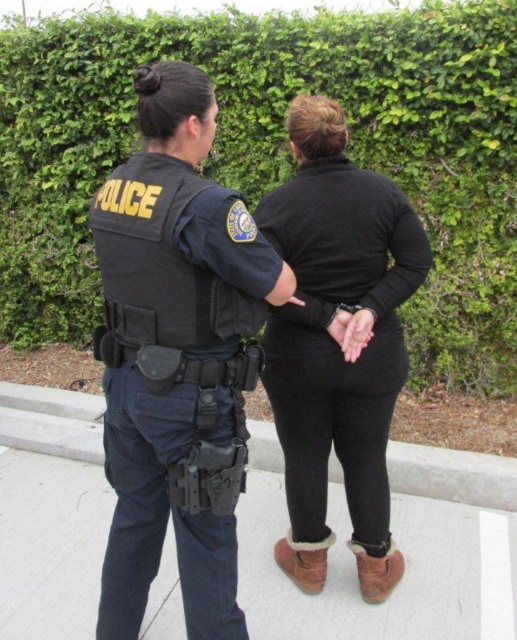
Does green leafy hedge at upper center appear over black matte sweater at center?

Indeed, green leafy hedge at upper center is positioned over black matte sweater at center.

Does green leafy hedge at upper center have a smaller size compared to black matte sweater at center?

No.

I want to click on green leafy hedge at upper center, so click(277, 150).

Is green leafy hedge at upper center thinner than black tactical vest at center?

In fact, green leafy hedge at upper center might be wider than black tactical vest at center.

Who is positioned more to the left, green leafy hedge at upper center or black tactical vest at center?

From the viewer's perspective, black tactical vest at center appears more on the left side.

Locate an element on the screen. green leafy hedge at upper center is located at coordinates (277, 150).

Identify the location of green leafy hedge at upper center. This screenshot has height=640, width=517. (277, 150).

Which is behind, point (83, 605) or point (377, 550)?

Point (377, 550)

Is gray concrete pavement at center to the left of black matte sweater at center from the viewer's perspective?

No, gray concrete pavement at center is not to the left of black matte sweater at center.

Locate an element on the screen. gray concrete pavement at center is located at coordinates (400, 582).

Where is `gray concrete pavement at center`? gray concrete pavement at center is located at coordinates (400, 582).